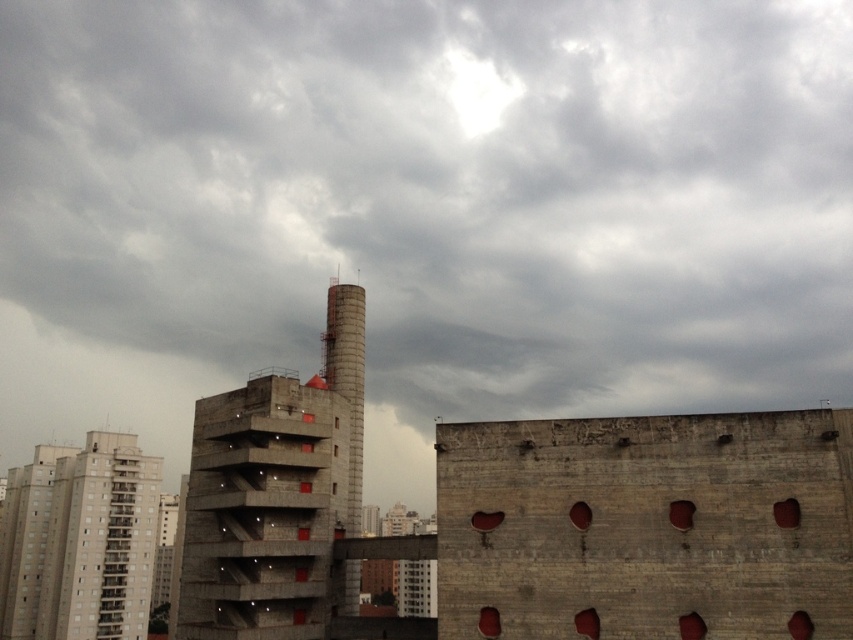
Question: Which object appears closest to the camera in this image?

Choices:
 (A) gray concrete building at lower left
 (B) smooth concrete chimney at center

Answer: (B)

Question: Is concrete building at center thinner than gray concrete building at lower left?

Choices:
 (A) no
 (B) yes

Answer: (A)

Question: Can you confirm if concrete building at center is smaller than smooth concrete chimney at center?

Choices:
 (A) no
 (B) yes

Answer: (A)

Question: Considering the relative positions of gray concrete building at lower left and smooth concrete chimney at center in the image provided, where is gray concrete building at lower left located with respect to smooth concrete chimney at center?

Choices:
 (A) right
 (B) left

Answer: (B)

Question: Which object is positioned closest to the smooth concrete chimney at center?

Choices:
 (A) gray concrete building at lower left
 (B) gray concrete building at center
 (C) concrete building at center

Answer: (C)

Question: Which point appears farthest from the camera in this image?

Choices:
 (A) (712, 464)
 (B) (398, 177)
 (C) (358, 396)
 (D) (122, 502)

Answer: (B)